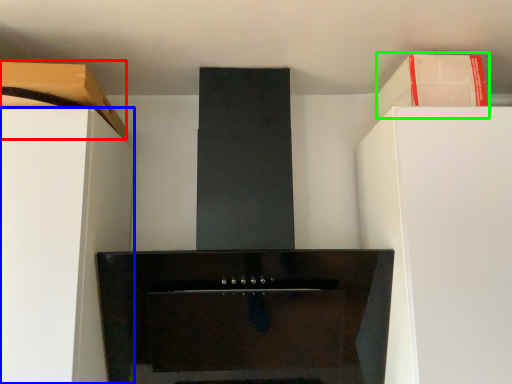
Question: Which object is positioned closest to cabinetry (highlighted by a red box)? Select from furniture (highlighted by a blue box) and cabinetry (highlighted by a green box).

Choices:
 (A) furniture
 (B) cabinetry

Answer: (A)